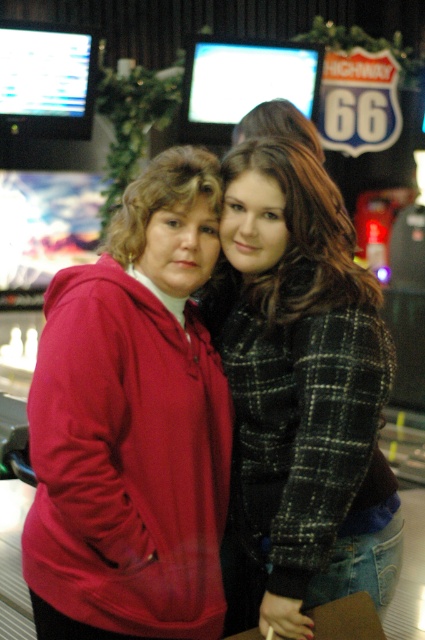
You are a photographer trying to capture a candid shot of the two people in the scene. You notice the plaid fabric jacket at center and the dark brown hair at center. Which object takes up more space horizontally in the image?

The plaid fabric jacket at center takes up more horizontal space than the dark brown hair at center because its width is larger.

You are a photographer setting up a shoot in this scene. You need to ensure that both the matte red hoodie at center and the plaid fabric jacket at center are clearly visible in the frame. Given their sizes, which clothing item might require you to adjust your camera angle to capture more detail?

The matte red hoodie at center has a smaller size compared to the plaid fabric jacket at center, so the matte red hoodie at center might need a closer camera angle or zoom to ensure its details are captured clearly.